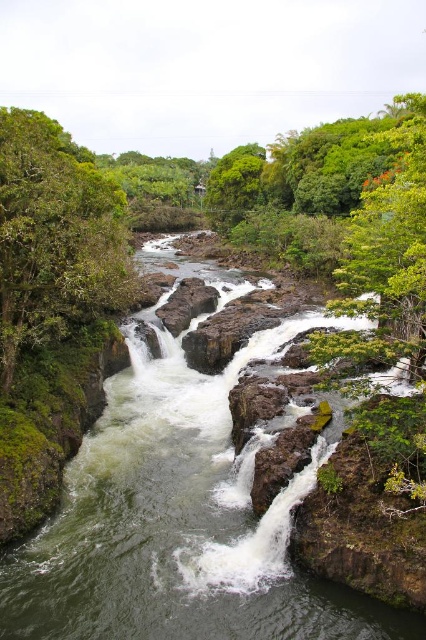
Question: Among these points, which one is nearest to the camera?

Choices:
 (A) (60, 561)
 (B) (3, 140)

Answer: (A)

Question: Which point is farther to the camera?

Choices:
 (A) white frothy water at center
 (B) rough brown rock at center
 (C) green leafy tree at left

Answer: (B)

Question: Which of the following is the closest to the observer?

Choices:
 (A) (112, 202)
 (B) (356, 598)

Answer: (B)

Question: Does white frothy water at center have a larger size compared to green leafy tree at left?

Choices:
 (A) yes
 (B) no

Answer: (A)

Question: From the image, what is the correct spatial relationship of white frothy water at center in relation to rough brown rock at center?

Choices:
 (A) right
 (B) left

Answer: (A)

Question: Does white frothy water at center have a greater width compared to rough brown rock at center?

Choices:
 (A) yes
 (B) no

Answer: (A)